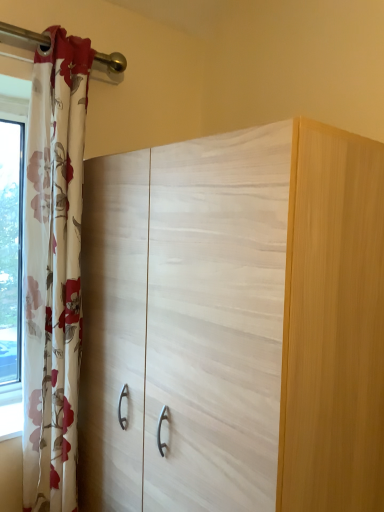
Question: From a real-world perspective, is white wood cupboard at center physically located above or below floral sheer curtain at left?

Choices:
 (A) below
 (B) above

Answer: (A)

Question: Which is correct: white wood cupboard at center is inside floral sheer curtain at left, or outside of it?

Choices:
 (A) inside
 (B) outside

Answer: (B)

Question: Is white wood cupboard at center wider or thinner than floral sheer curtain at left?

Choices:
 (A) wide
 (B) thin

Answer: (A)

Question: Do you think floral sheer curtain at left is within white wood cupboard at center, or outside of it?

Choices:
 (A) inside
 (B) outside

Answer: (B)

Question: In the image, is floral sheer curtain at left positioned in front of or behind white wood cupboard at center?

Choices:
 (A) behind
 (B) front

Answer: (A)

Question: Is floral sheer curtain at left wider or thinner than white wood cupboard at center?

Choices:
 (A) wide
 (B) thin

Answer: (B)

Question: Is point (36, 414) closer or farther from the camera than point (312, 426)?

Choices:
 (A) farther
 (B) closer

Answer: (A)